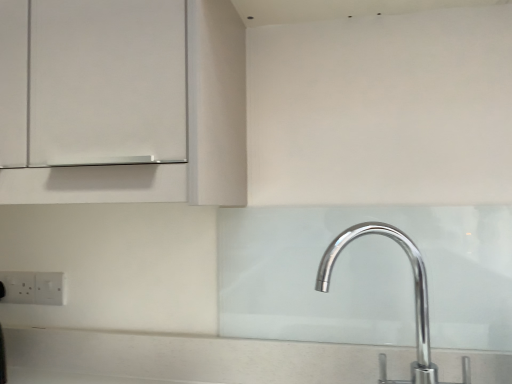
This screenshot has height=384, width=512. What do you see at coordinates (18, 287) in the screenshot?
I see `white plastic electric outlet at lower left, marked as the first electric outlet in a left-to-right arrangement` at bounding box center [18, 287].

Find the location of a particular element. Image resolution: width=512 pixels, height=384 pixels. white plastic electric outlet at lower left, acting as the second electric outlet starting from the left is located at coordinates (49, 288).

Locate an element on the screen. This screenshot has width=512, height=384. polished chrome tap at lower right is located at coordinates (414, 292).

In the scene shown: Are white plastic electric outlet at lower left, which ranks as the first electric outlet in right-to-left order, and polished chrome tap at lower right located far from each other?

white plastic electric outlet at lower left, which ranks as the first electric outlet in right-to-left order, is actually quite close to polished chrome tap at lower right.

Which is more to the left, white plastic electric outlet at lower left, which ranks as the first electric outlet in right-to-left order, or polished chrome tap at lower right?

From the viewer's perspective, white plastic electric outlet at lower left, which ranks as the first electric outlet in right-to-left order, appears more on the left side.

From the image's perspective, is white plastic electric outlet at lower left, which ranks as the first electric outlet in right-to-left order, on polished chrome tap at lower right?

→ No, from the image's perspective, white plastic electric outlet at lower left, which ranks as the first electric outlet in right-to-left order, is not above polished chrome tap at lower right.

Is white plastic electric outlet at lower left, which ranks as the first electric outlet in right-to-left order, positioned beyond the bounds of polished chrome tap at lower right?

Yes.

Is the position of white plastic electric outlet at lower left, marked as the first electric outlet in a left-to-right arrangement, more distant than that of white plastic electric outlet at lower left, acting as the second electric outlet starting from the left?

Yes, the depth of white plastic electric outlet at lower left, marked as the first electric outlet in a left-to-right arrangement, is greater than that of white plastic electric outlet at lower left, acting as the second electric outlet starting from the left.

Considering the sizes of objects white plastic electric outlet at lower left, marked as the first electric outlet in a left-to-right arrangement, and white plastic electric outlet at lower left, which ranks as the first electric outlet in right-to-left order, in the image provided, who is wider, white plastic electric outlet at lower left, marked as the first electric outlet in a left-to-right arrangement, or white plastic electric outlet at lower left, which ranks as the first electric outlet in right-to-left order,?

Wider between the two is white plastic electric outlet at lower left, which ranks as the first electric outlet in right-to-left order.

Does white plastic electric outlet at lower left, marked as the 2th electric outlet in a right-to-left arrangement, have a larger size compared to white plastic electric outlet at lower left, which ranks as the first electric outlet in right-to-left order?

Yes, white plastic electric outlet at lower left, marked as the 2th electric outlet in a right-to-left arrangement, is bigger than white plastic electric outlet at lower left, which ranks as the first electric outlet in right-to-left order.

Could white plastic electric outlet at lower left, acting as the second electric outlet starting from the left, be considered to be inside white plastic electric outlet at lower left, marked as the first electric outlet in a left-to-right arrangement?

No, white plastic electric outlet at lower left, acting as the second electric outlet starting from the left, is not a part of white plastic electric outlet at lower left, marked as the first electric outlet in a left-to-right arrangement.

Would you say white plastic electric outlet at lower left, marked as the first electric outlet in a left-to-right arrangement, is to the left or to the right of polished chrome tap at lower right in the picture?

Based on their positions, white plastic electric outlet at lower left, marked as the first electric outlet in a left-to-right arrangement, is located to the left of polished chrome tap at lower right.

From the picture: From their relative heights in the image, would you say white plastic electric outlet at lower left, marked as the first electric outlet in a left-to-right arrangement, is taller or shorter than polished chrome tap at lower right?

white plastic electric outlet at lower left, marked as the first electric outlet in a left-to-right arrangement, is shorter than polished chrome tap at lower right.

Measure the distance between white plastic electric outlet at lower left, marked as the 2th electric outlet in a right-to-left arrangement, and polished chrome tap at lower right.

white plastic electric outlet at lower left, marked as the 2th electric outlet in a right-to-left arrangement, is 34.61 inches from polished chrome tap at lower right.

From the image's perspective, who appears lower, white plastic electric outlet at lower left, which ranks as the first electric outlet in right-to-left order, or white plastic electric outlet at lower left, marked as the first electric outlet in a left-to-right arrangement?

white plastic electric outlet at lower left, marked as the first electric outlet in a left-to-right arrangement, from the image's perspective.

Can we say white plastic electric outlet at lower left, acting as the second electric outlet starting from the left, lies outside white plastic electric outlet at lower left, marked as the first electric outlet in a left-to-right arrangement?

Absolutely, white plastic electric outlet at lower left, acting as the second electric outlet starting from the left, is external to white plastic electric outlet at lower left, marked as the first electric outlet in a left-to-right arrangement.

Is white plastic electric outlet at lower left, which ranks as the first electric outlet in right-to-left order, wider than white plastic electric outlet at lower left, marked as the 2th electric outlet in a right-to-left arrangement?

No.

Choose the correct answer: Is polished chrome tap at lower right inside white plastic electric outlet at lower left, which ranks as the first electric outlet in right-to-left order, or outside it?

polished chrome tap at lower right cannot be found inside white plastic electric outlet at lower left, which ranks as the first electric outlet in right-to-left order.

Is point (338, 250) positioned before point (50, 304)?

Yes, it is in front of point (50, 304).

Who is taller, polished chrome tap at lower right or white plastic electric outlet at lower left, which ranks as the first electric outlet in right-to-left order?

polished chrome tap at lower right.

Would you consider polished chrome tap at lower right to be distant from white plastic electric outlet at lower left, marked as the first electric outlet in a left-to-right arrangement?

No, polished chrome tap at lower right is in close proximity to white plastic electric outlet at lower left, marked as the first electric outlet in a left-to-right arrangement.

Between polished chrome tap at lower right and white plastic electric outlet at lower left, marked as the first electric outlet in a left-to-right arrangement, which one appears on the right side from the viewer's perspective?

polished chrome tap at lower right.

Does polished chrome tap at lower right have a greater height compared to white plastic electric outlet at lower left, marked as the 2th electric outlet in a right-to-left arrangement?

Yes, polished chrome tap at lower right is taller than white plastic electric outlet at lower left, marked as the 2th electric outlet in a right-to-left arrangement.

There is a polished chrome tap at lower right. Where is `the 1st electric outlet below it (from the image's perspective)`? the 1st electric outlet below it (from the image's perspective) is located at coordinates (49, 288).

Locate an element on the screen. The width and height of the screenshot is (512, 384). electric outlet lying in front of the white plastic electric outlet at lower left, marked as the first electric outlet in a left-to-right arrangement is located at coordinates (49, 288).

Considering their positions, is white plastic electric outlet at lower left, acting as the second electric outlet starting from the left, positioned closer to white plastic electric outlet at lower left, marked as the 2th electric outlet in a right-to-left arrangement, than polished chrome tap at lower right?

white plastic electric outlet at lower left, acting as the second electric outlet starting from the left.

When comparing their distances from white plastic electric outlet at lower left, marked as the 2th electric outlet in a right-to-left arrangement, does polished chrome tap at lower right or white plastic electric outlet at lower left, which ranks as the first electric outlet in right-to-left order, seem closer?

white plastic electric outlet at lower left, which ranks as the first electric outlet in right-to-left order, lies closer to white plastic electric outlet at lower left, marked as the 2th electric outlet in a right-to-left arrangement, than the other object.

Based on their spatial positions, is white plastic electric outlet at lower left, marked as the 2th electric outlet in a right-to-left arrangement, or polished chrome tap at lower right closer to white plastic electric outlet at lower left, which ranks as the first electric outlet in right-to-left order?

Among the two, white plastic electric outlet at lower left, marked as the 2th electric outlet in a right-to-left arrangement, is located nearer to white plastic electric outlet at lower left, which ranks as the first electric outlet in right-to-left order.

From the image, which object appears to be farther from polished chrome tap at lower right, white plastic electric outlet at lower left, acting as the second electric outlet starting from the left, or white plastic electric outlet at lower left, marked as the 2th electric outlet in a right-to-left arrangement?

white plastic electric outlet at lower left, marked as the 2th electric outlet in a right-to-left arrangement, is positioned further to the anchor polished chrome tap at lower right.

Which object lies further to the anchor point white plastic electric outlet at lower left, acting as the second electric outlet starting from the left, polished chrome tap at lower right or white plastic electric outlet at lower left, marked as the first electric outlet in a left-to-right arrangement?

polished chrome tap at lower right is further to white plastic electric outlet at lower left, acting as the second electric outlet starting from the left.

When comparing their distances from polished chrome tap at lower right, does white plastic electric outlet at lower left, marked as the first electric outlet in a left-to-right arrangement, or white plastic electric outlet at lower left, acting as the second electric outlet starting from the left, seem closer?

Based on the image, white plastic electric outlet at lower left, acting as the second electric outlet starting from the left, appears to be nearer to polished chrome tap at lower right.

Find the location of `electric outlet between white plastic electric outlet at lower left, marked as the first electric outlet in a left-to-right arrangement, and polished chrome tap at lower right`. electric outlet between white plastic electric outlet at lower left, marked as the first electric outlet in a left-to-right arrangement, and polished chrome tap at lower right is located at coordinates (49, 288).